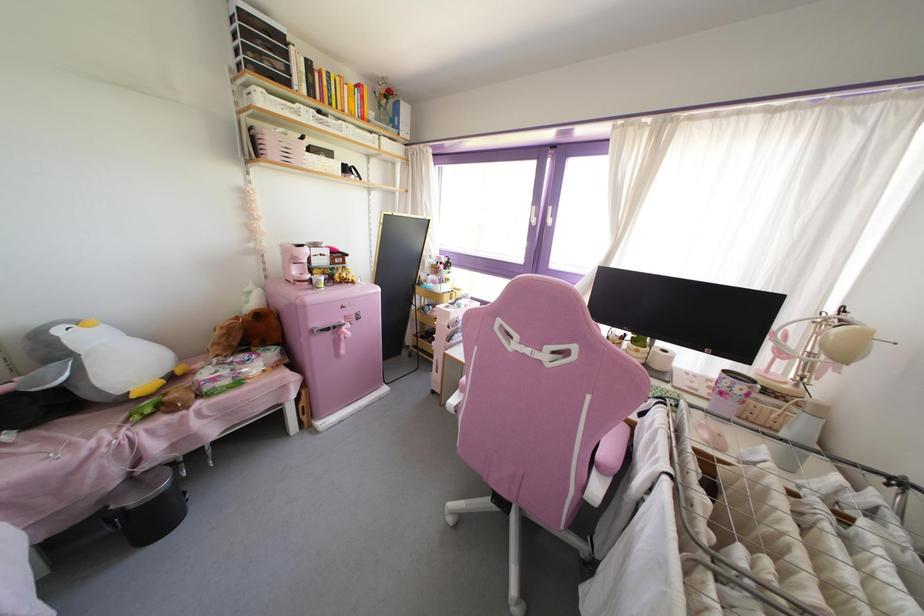
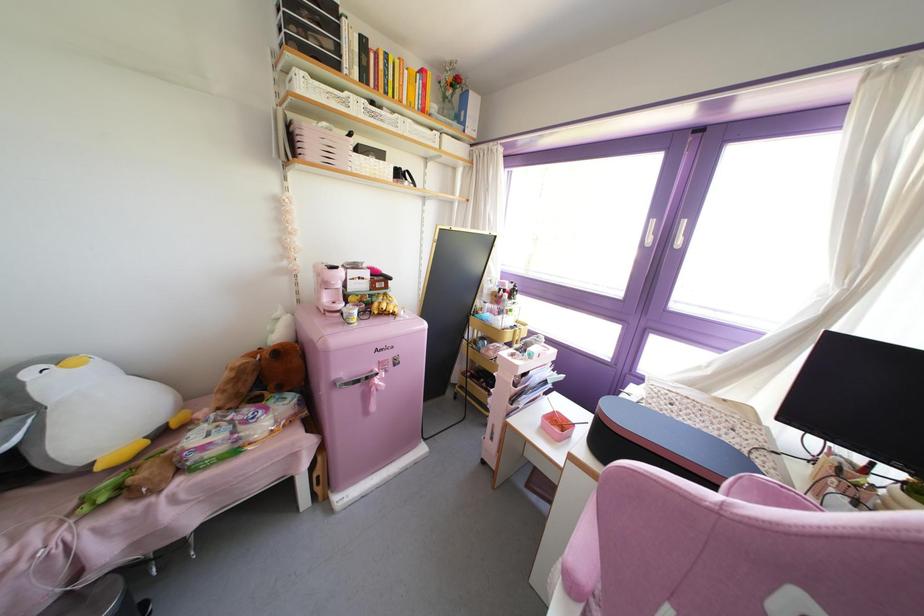
Question: I am providing you with two images of the same scene from different viewpoints. After the viewpoint changes to image2, which objects are now occluded?

Choices:
 (A) white storage basket
 (B) silver refrigerator handle
 (C) white window handle
 (D) none of these

Answer: (D)